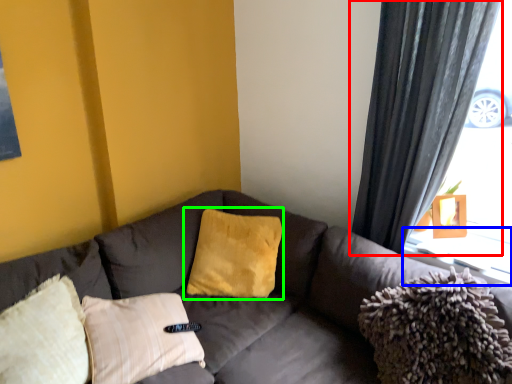
Question: Based on their relative distances, which object is nearer to curtain (highlighted by a red box)? Choose from window sill (highlighted by a blue box) and pillow (highlighted by a green box).

Choices:
 (A) window sill
 (B) pillow

Answer: (A)